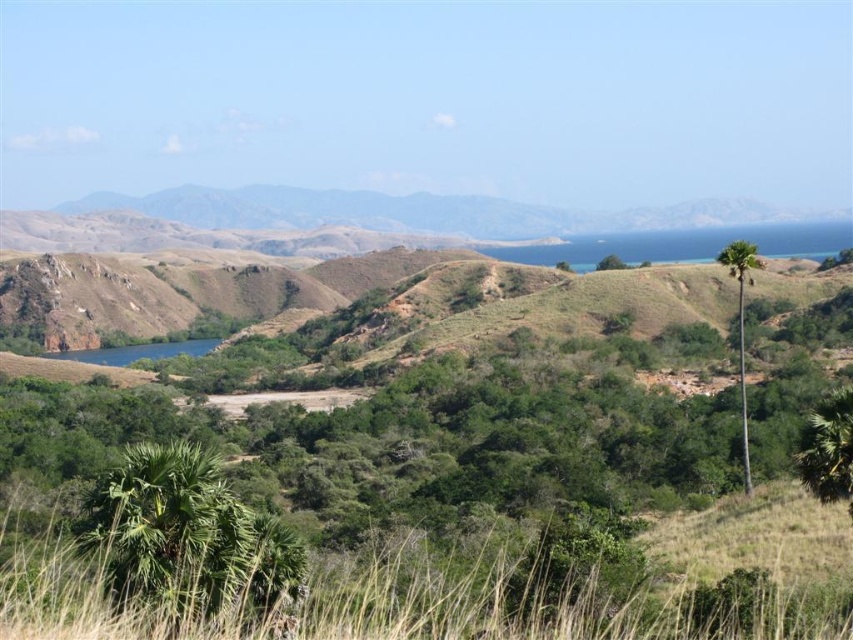
Question: Does green leafy palm tree at right appear over green leafy tree at center?

Choices:
 (A) yes
 (B) no

Answer: (B)

Question: Is green leafy palm tree at right positioned before green leafy tree at center?

Choices:
 (A) no
 (B) yes

Answer: (B)

Question: Which point is farther to the camera?

Choices:
 (A) green leafy palm tree at right
 (B) green leafy tree at center

Answer: (B)

Question: Does green leafy palm tree at right have a larger size compared to green leafy tree at center?

Choices:
 (A) yes
 (B) no

Answer: (B)